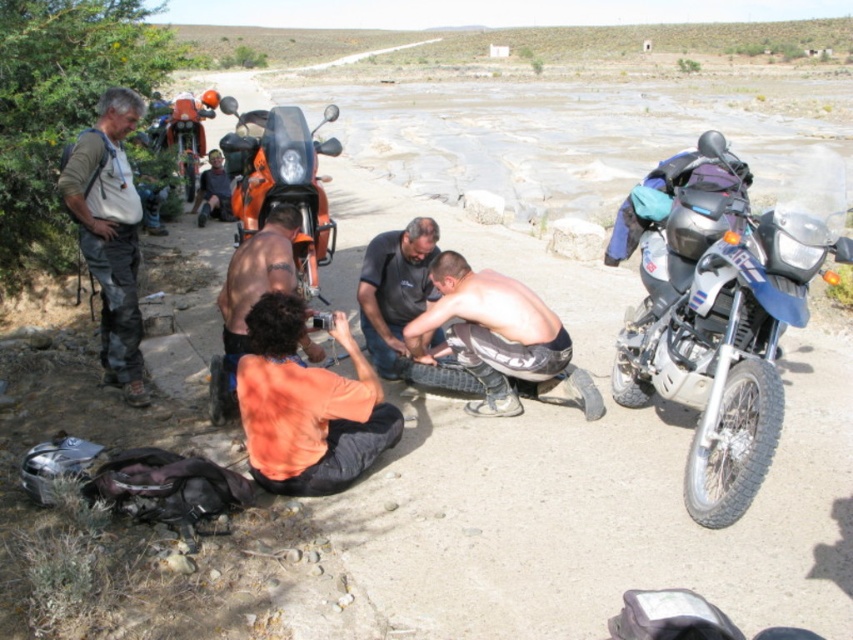
Question: Which object is the closest to the blue metallic motorcycle at center?

Choices:
 (A) black rubber tire at right
 (B) orange matte motorcycle at center

Answer: (A)

Question: Which object is farther from the camera taking this photo?

Choices:
 (A) orange matte motorcycle at center
 (B) blue metallic motorcycle at center

Answer: (A)

Question: Can you confirm if orange shirt at center is smaller than orange fabric shirt at center?

Choices:
 (A) yes
 (B) no

Answer: (A)

Question: Among these points, which one is nearest to the camera?

Choices:
 (A) pos(404,252)
 (B) pos(270,115)

Answer: (A)

Question: Is the position of shiny black tire at center less distant than that of green fabric backpack at left?

Choices:
 (A) yes
 (B) no

Answer: (B)

Question: Where is shiny black tire at center located in relation to black rubber tire at right in the image?

Choices:
 (A) above
 (B) below

Answer: (B)